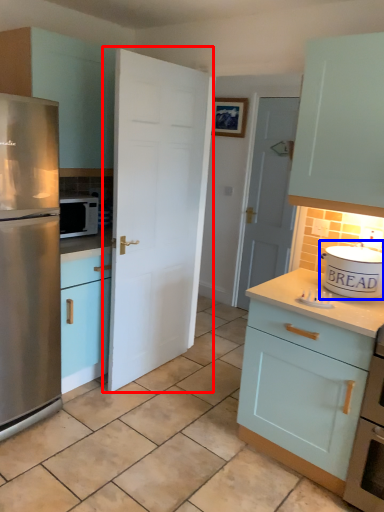
Question: Among these objects, which one is farthest to the camera, door (highlighted by a red box) or appliance (highlighted by a blue box)?

Choices:
 (A) door
 (B) appliance

Answer: (A)